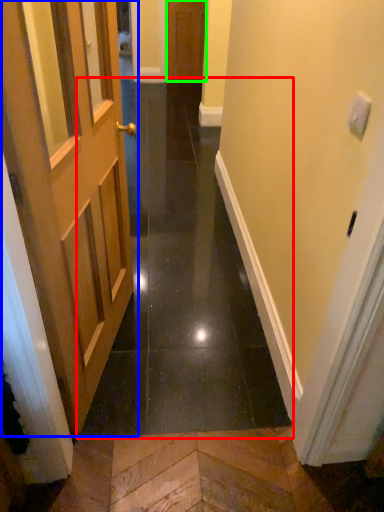
Question: Based on their relative distances, which object is farther from path (highlighted by a red box)? Choose from door (highlighted by a blue box) and door (highlighted by a green box).

Choices:
 (A) door
 (B) door

Answer: (B)